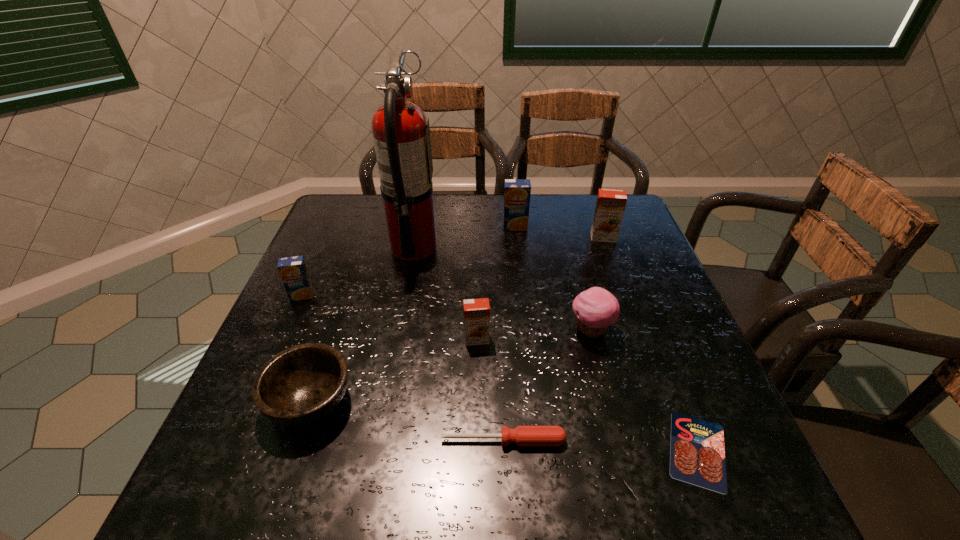
This screenshot has width=960, height=540. Find the location of `the nearer orange orange juice`. the nearer orange orange juice is located at coordinates (476, 311).

Where is `the left orange orange juice`? The height and width of the screenshot is (540, 960). the left orange orange juice is located at coordinates (476, 311).

At what (x,y) coordinates should I click in order to perform the action: click on bowl. Please return your answer as a coordinate pair (x, y). Looking at the image, I should click on (300, 385).

The width and height of the screenshot is (960, 540). Identify the location of the seventh tallest object. (300, 385).

Find the location of `the eighth tallest object`. the eighth tallest object is located at coordinates (522, 435).

Locate an element on the screen. The width and height of the screenshot is (960, 540). red screwdriver is located at coordinates (522, 435).

What are the coordinates of `salami` in the screenshot? It's located at (697, 456).

Where is `free space located 0.300m on the nozzle side of the fire extinguisher`? This screenshot has height=540, width=960. free space located 0.300m on the nozzle side of the fire extinguisher is located at coordinates (544, 247).

This screenshot has width=960, height=540. In order to click on vacant area situated 0.190m on the front of the third nearest orange juice in this screenshot , I will do `click(622, 288)`.

Where is `vacant position located 0.240m on the left of the bigger blue orange_juice`? The width and height of the screenshot is (960, 540). vacant position located 0.240m on the left of the bigger blue orange_juice is located at coordinates (422, 226).